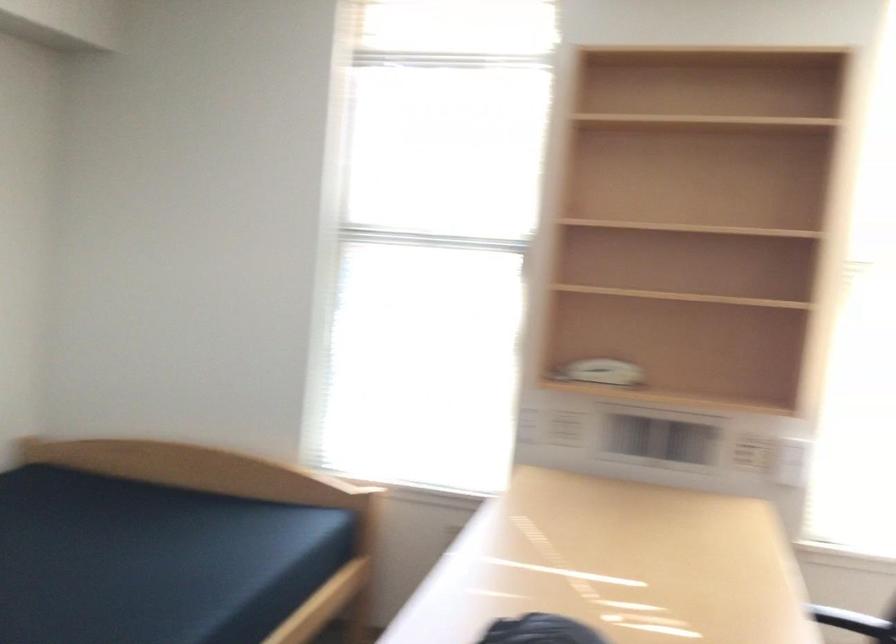
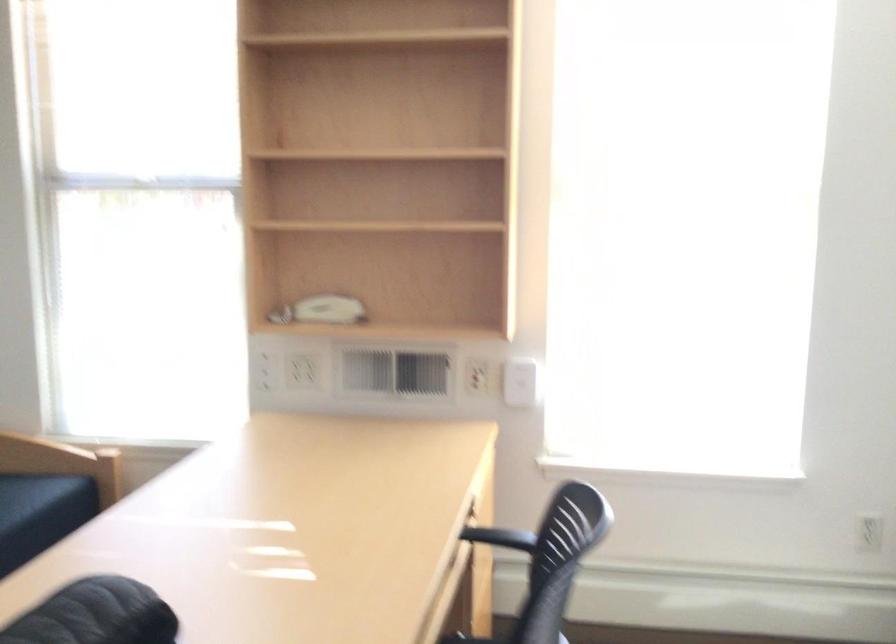
Question: The images are taken continuously from a first-person perspective. In which direction are you moving?

Choices:
 (A) Left
 (B) Right
 (C) Forward
 (D) Backward

Answer: (B)